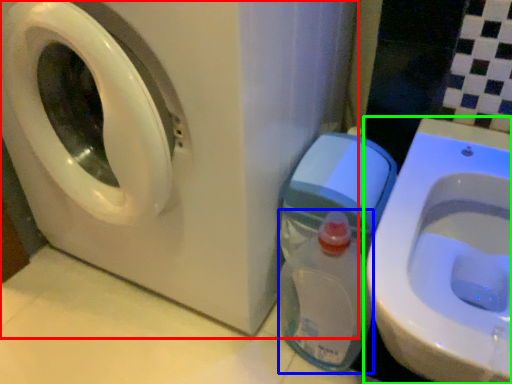
Question: Which is nearer to the washing machine (highlighted by a red box)? baby bottle (highlighted by a blue box) or toilet (highlighted by a green box).

Choices:
 (A) baby bottle
 (B) toilet

Answer: (A)